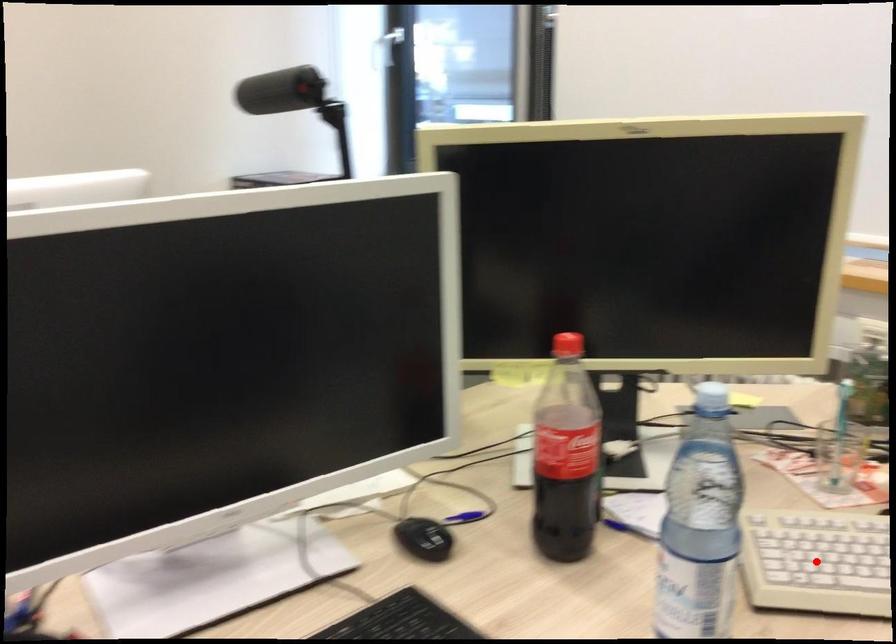
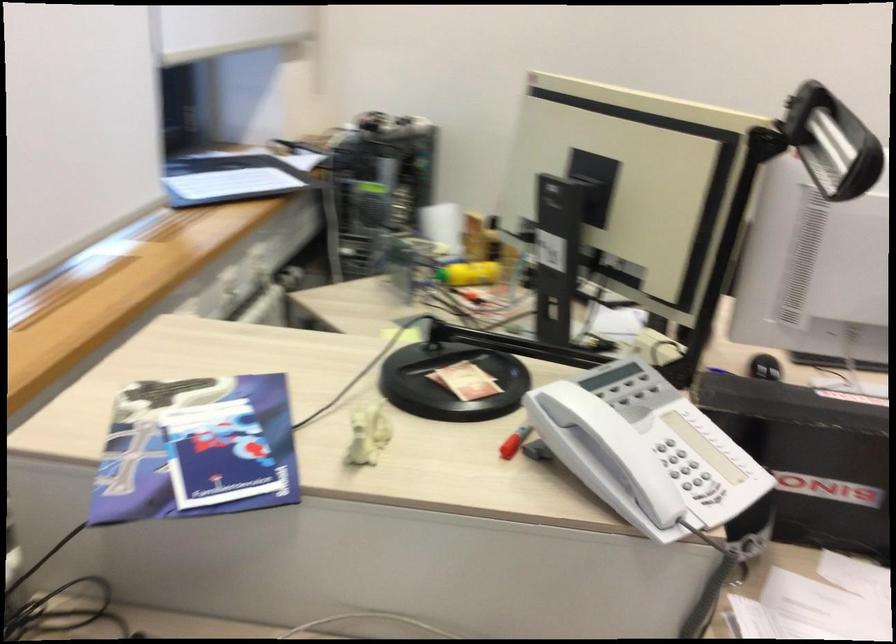
Question: I am providing you with two images of the same scene from different viewpoints. A red point is marked on the first image. Can you still see the location of the red point in image 2?

Choices:
 (A) Yes
 (B) No

Answer: (B)